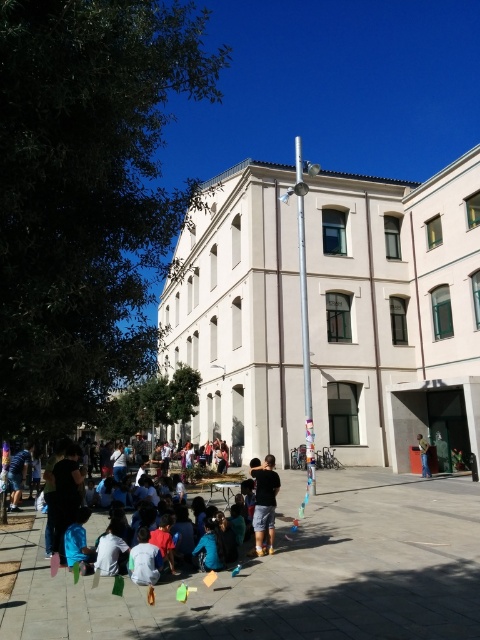
Is blue cotton shirt at lower left above denim jacket at lower right?

Indeed, blue cotton shirt at lower left is positioned over denim jacket at lower right.

Can you confirm if blue cotton shirt at lower left is positioned to the left of denim jacket at lower right?

Correct, you'll find blue cotton shirt at lower left to the left of denim jacket at lower right.

Locate an element on the screen. blue cotton shirt at lower left is located at coordinates (62, 499).

This screenshot has width=480, height=640. I want to click on blue cotton shirt at lower left, so click(x=62, y=499).

Is blue cotton shirt at lower left positioned behind dark blue shorts at center?

No, blue cotton shirt at lower left is closer to the viewer.

Between point (79, 481) and point (262, 528), which one is positioned in front?

Positioned in front is point (262, 528).

The width and height of the screenshot is (480, 640). I want to click on blue cotton shirt at lower left, so pyautogui.click(x=62, y=499).

Is silver metallic pole at center positioned before dark blue shorts at center?

No.

Between point (299, 225) and point (263, 516), which one is positioned in front?

Point (263, 516) is more forward.

Where is `silver metallic pole at center`? The width and height of the screenshot is (480, 640). silver metallic pole at center is located at coordinates (304, 307).